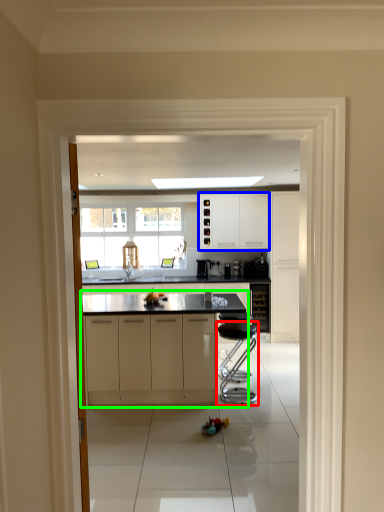
Question: Which is farther away from bar stool (highlighted by a red box)? cabinetry (highlighted by a blue box) or cabinetry (highlighted by a green box)?

Choices:
 (A) cabinetry
 (B) cabinetry

Answer: (A)